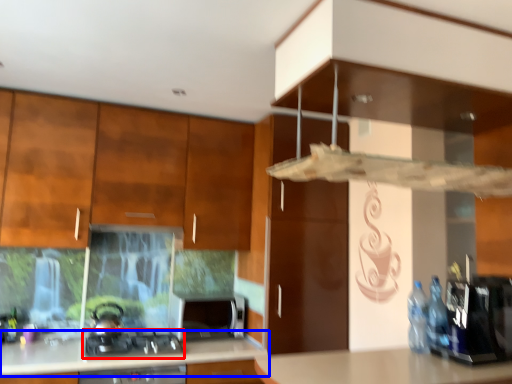
Question: Among these objects, which one is farthest to the camera, gas stove (highlighted by a red box) or countertop (highlighted by a blue box)?

Choices:
 (A) gas stove
 (B) countertop

Answer: (A)